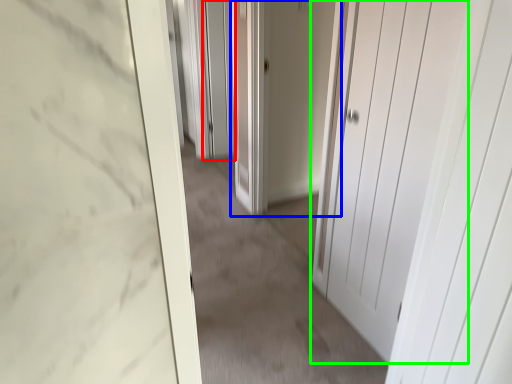
Question: Considering the real-world distances, which object is farthest from screen door (highlighted by a red box)? door (highlighted by a blue box) or door (highlighted by a green box)?

Choices:
 (A) door
 (B) door

Answer: (B)